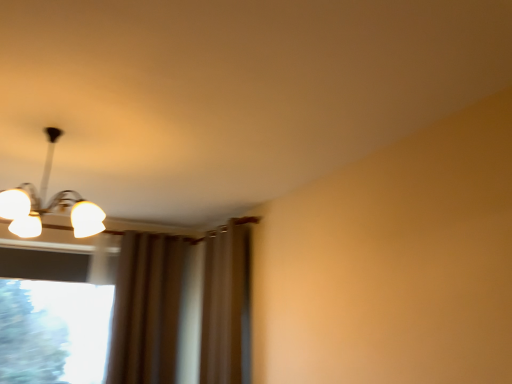
Question: Considering the relative positions of brown fabric curtain at center and transparent glass window at lower left in the image provided, is brown fabric curtain at center to the right of transparent glass window at lower left from the viewer's perspective?

Choices:
 (A) no
 (B) yes

Answer: (B)

Question: Is brown fabric curtain at center positioned in front of transparent glass window at lower left?

Choices:
 (A) yes
 (B) no

Answer: (A)

Question: From the image's perspective, is brown fabric curtain at center on transparent glass window at lower left?

Choices:
 (A) no
 (B) yes

Answer: (B)

Question: Considering the relative sizes of brown fabric curtain at center and transparent glass window at lower left in the image provided, is brown fabric curtain at center wider than transparent glass window at lower left?

Choices:
 (A) yes
 (B) no

Answer: (A)

Question: From the image's perspective, is brown fabric curtain at center beneath transparent glass window at lower left?

Choices:
 (A) no
 (B) yes

Answer: (A)

Question: From a real-world perspective, is brown fabric curtain at center under transparent glass window at lower left?

Choices:
 (A) yes
 (B) no

Answer: (B)

Question: Does transparent glass window at lower left come behind white glossy light fixture at upper left?

Choices:
 (A) yes
 (B) no

Answer: (A)

Question: Does transparent glass window at lower left have a lesser width compared to white glossy light fixture at upper left?

Choices:
 (A) yes
 (B) no

Answer: (A)

Question: From the image's perspective, is transparent glass window at lower left over white glossy light fixture at upper left?

Choices:
 (A) no
 (B) yes

Answer: (A)

Question: Is transparent glass window at lower left to the right of white glossy light fixture at upper left from the viewer's perspective?

Choices:
 (A) yes
 (B) no

Answer: (B)

Question: Considering the relative sizes of transparent glass window at lower left and white glossy light fixture at upper left in the image provided, is transparent glass window at lower left wider than white glossy light fixture at upper left?

Choices:
 (A) yes
 (B) no

Answer: (B)

Question: Does transparent glass window at lower left have a greater height compared to white glossy light fixture at upper left?

Choices:
 (A) no
 (B) yes

Answer: (B)

Question: Considering the relative sizes of transparent glass window at lower left and brown fabric curtain at center in the image provided, is transparent glass window at lower left bigger than brown fabric curtain at center?

Choices:
 (A) no
 (B) yes

Answer: (A)